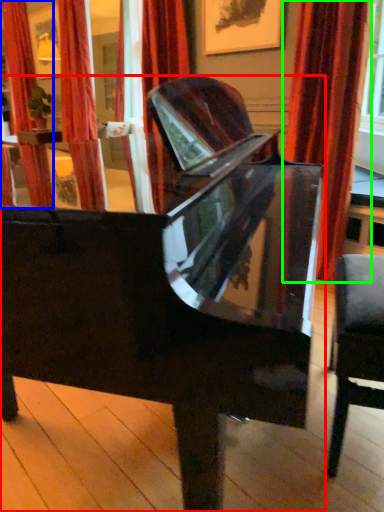
Question: Based on their relative distances, which object is nearer to piano (highlighted by a red box)? Choose from curtain (highlighted by a blue box) and curtain (highlighted by a green box).

Choices:
 (A) curtain
 (B) curtain

Answer: (B)